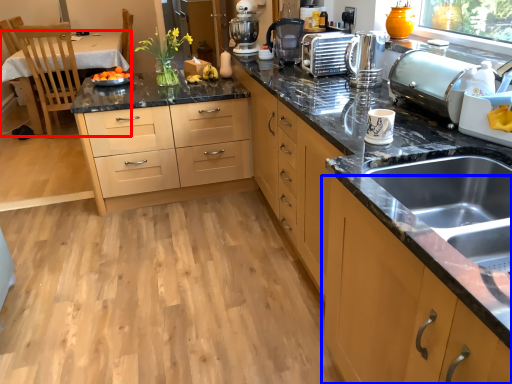
Question: Among these objects, which one is nearest to the camera, table (highlighted by a red box) or cabinetry (highlighted by a blue box)?

Choices:
 (A) table
 (B) cabinetry

Answer: (B)